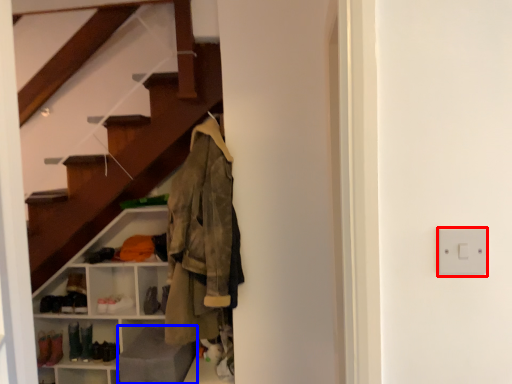
Question: Which of the following is the closest to the observer, electric outlet (highlighted by a red box) or gray (highlighted by a blue box)?

Choices:
 (A) electric outlet
 (B) gray

Answer: (A)